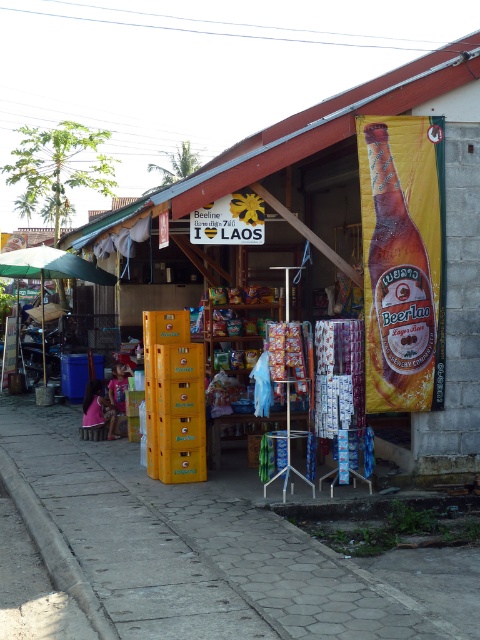
Question: Which object is farther from the camera taking this photo?

Choices:
 (A) gray concrete curb at lower left
 (B) smooth concrete pavement at center
 (C) yellow plastic crates at center

Answer: (C)

Question: Does smooth concrete pavement at center come behind gray concrete curb at lower left?

Choices:
 (A) yes
 (B) no

Answer: (A)

Question: Does smooth concrete pavement at center appear under golden glass beer bottle at right?

Choices:
 (A) no
 (B) yes

Answer: (B)

Question: Which point is farther from the camera taking this photo?

Choices:
 (A) (88, 598)
 (B) (456, 52)
 (C) (419, 138)

Answer: (B)

Question: Can you confirm if smooth concrete pavement at center is bigger than gray concrete curb at lower left?

Choices:
 (A) yes
 (B) no

Answer: (B)

Question: Which of the following is the closest to the observer?

Choices:
 (A) (45, 557)
 (B) (255, 524)
 (C) (406, 374)

Answer: (A)